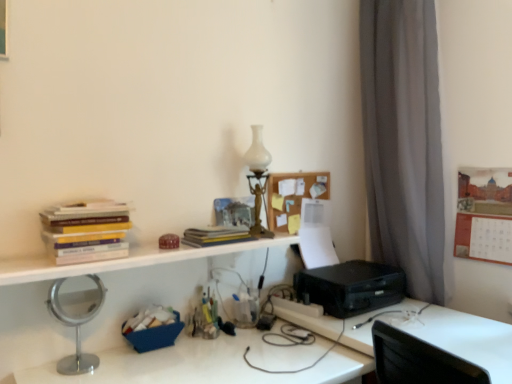
Locate an element on the screen. vacant point above silver metallic mirror at lower left (from a real-world perspective) is located at coordinates (242, 359).